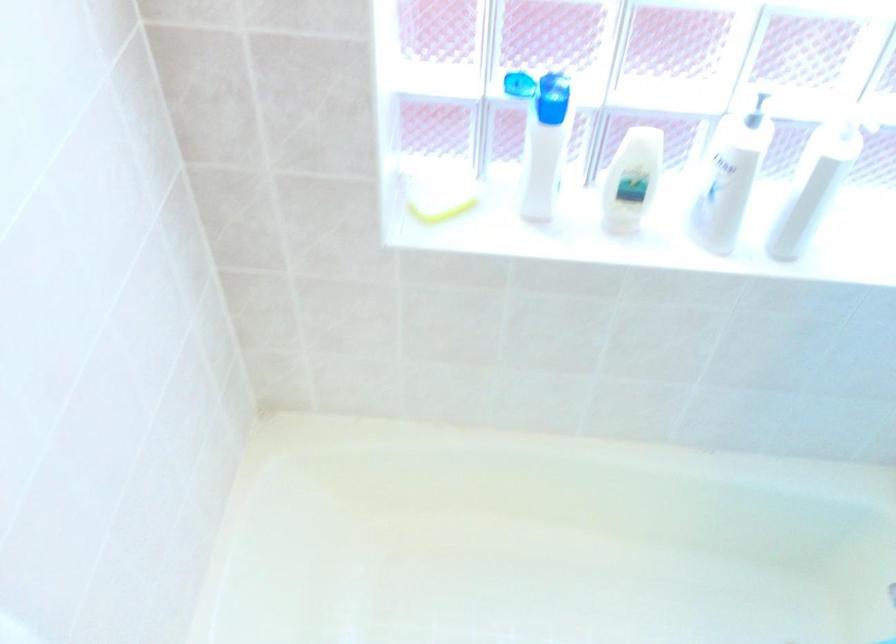
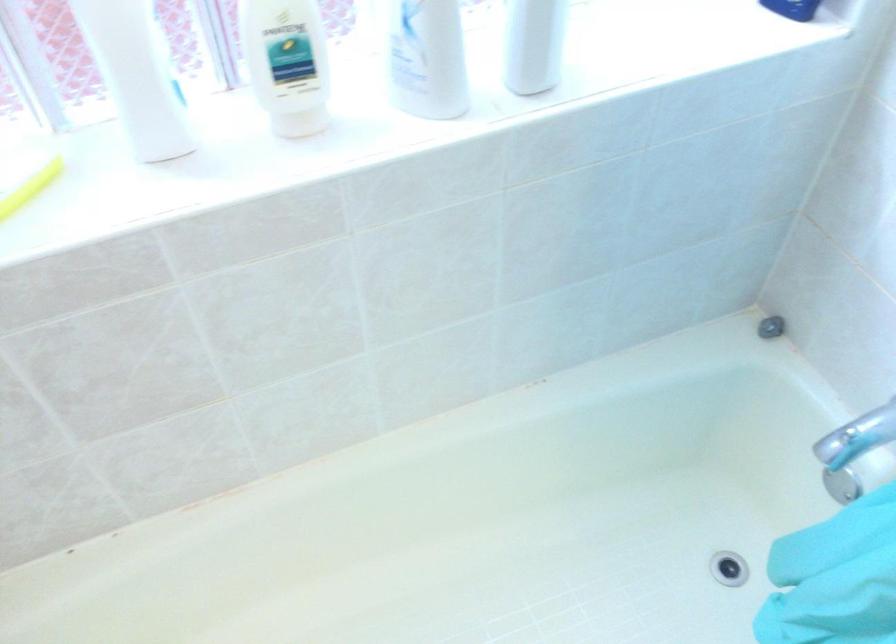
Question: The camera is either moving clockwise (left) or counter-clockwise (right) around the object. The first image is from the beginning of the video and the second image is from the end. Is the camera moving left or right when shooting the video?

Choices:
 (A) Left
 (B) Right

Answer: (A)